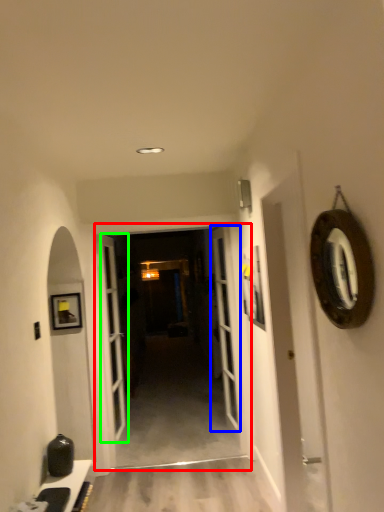
Question: Based on their relative distances, which object is nearer to garage door (highlighted by a red box)? Choose from door (highlighted by a blue box) and door (highlighted by a green box).

Choices:
 (A) door
 (B) door

Answer: (A)